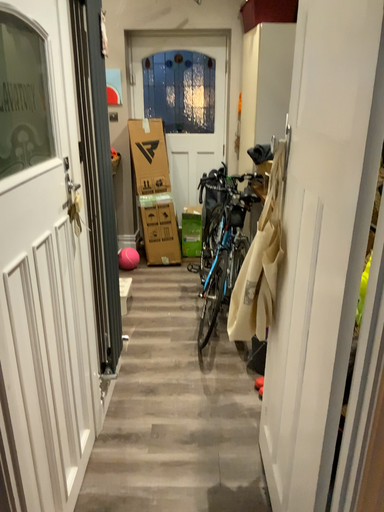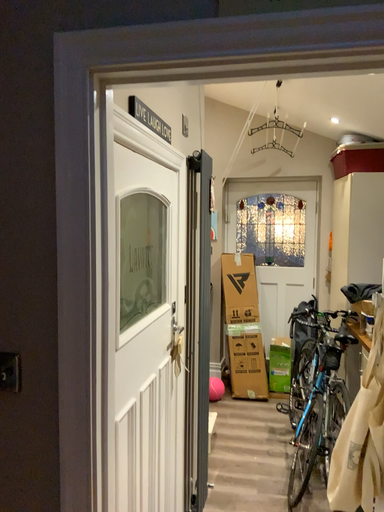
Question: How did the camera likely rotate when shooting the video?

Choices:
 (A) rotated upward
 (B) rotated downward

Answer: (A)